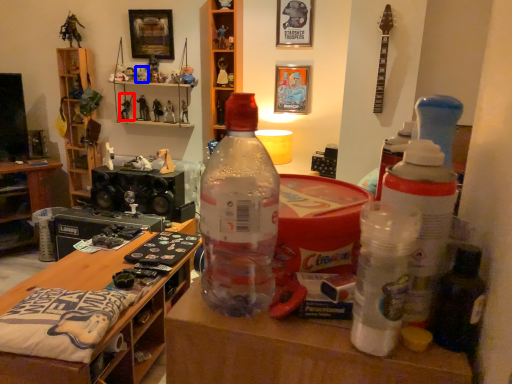
Question: Which object is closer to the camera taking this photo, toy (highlighted by a red box) or toy (highlighted by a blue box)?

Choices:
 (A) toy
 (B) toy

Answer: (B)